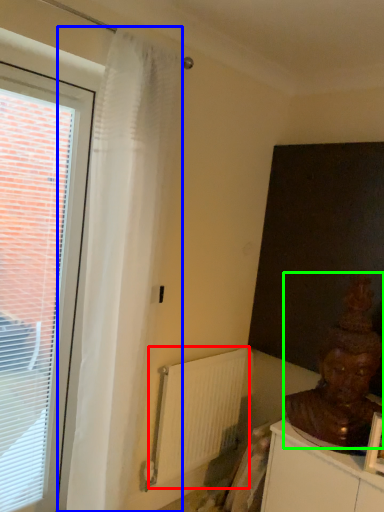
Question: Which is farther away from radiator (highlighted by a red box)? curtain (highlighted by a blue box) or person (highlighted by a green box)?

Choices:
 (A) curtain
 (B) person

Answer: (B)